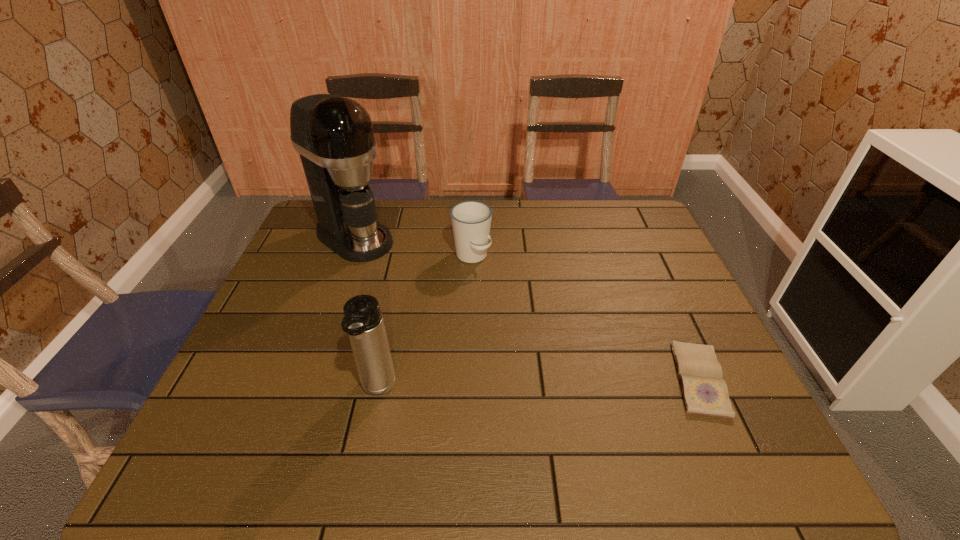
Where is `free space between the third shortest object and the shortest object`? The width and height of the screenshot is (960, 540). free space between the third shortest object and the shortest object is located at coordinates (x=539, y=384).

Find the location of `empty space between the cup and the diary`. empty space between the cup and the diary is located at coordinates (586, 318).

The height and width of the screenshot is (540, 960). I want to click on free space between the shortest object and the second object from left to right, so click(x=539, y=384).

This screenshot has width=960, height=540. Identify the location of free area in between the third object from left to right and the tallest object. (413, 247).

Select which object is the third closest to the cup. Please provide its 2D coordinates. Your answer should be formatted as a tuple, i.e. [(x, y)], where the tuple contains the x and y coordinates of a point satisfying the conditions above.

[(704, 391)]

Point out which object is positioned as the second nearest to the leftmost object. Please provide its 2D coordinates. Your answer should be formatted as a tuple, i.e. [(x, y)], where the tuple contains the x and y coordinates of a point satisfying the conditions above.

[(363, 320)]